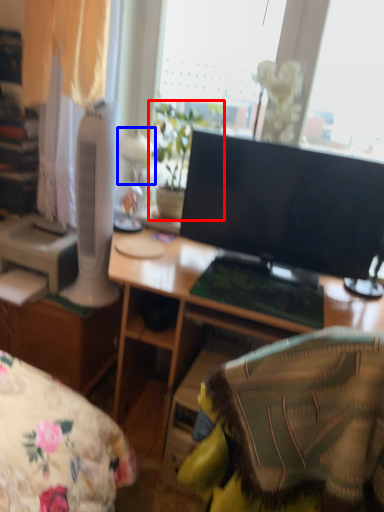
Question: Which of the following is the farthest to the observer, houseplant (highlighted by a red box) or table lamp (highlighted by a blue box)?

Choices:
 (A) houseplant
 (B) table lamp

Answer: (B)